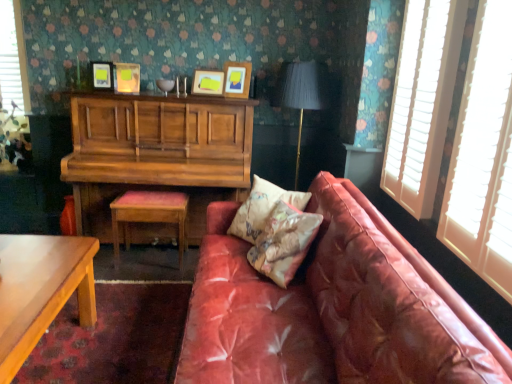
Question: Does matte black lampshade at center lie behind matte wooden picture frame at upper center, placed as the 2th picture frame when sorted from right to left?

Choices:
 (A) yes
 (B) no

Answer: (B)

Question: Is matte black lampshade at center to the right of matte wooden picture frame at upper center, marked as the 3th picture frame in a left-to-right arrangement, from the viewer's perspective?

Choices:
 (A) no
 (B) yes

Answer: (B)

Question: Does matte black lampshade at center lie in front of matte wooden picture frame at upper center, marked as the 3th picture frame in a left-to-right arrangement?

Choices:
 (A) no
 (B) yes

Answer: (B)

Question: Considering the relative sizes of matte black lampshade at center and matte wooden picture frame at upper center, marked as the 3th picture frame in a left-to-right arrangement, in the image provided, is matte black lampshade at center wider than matte wooden picture frame at upper center, marked as the 3th picture frame in a left-to-right arrangement,?

Choices:
 (A) no
 (B) yes

Answer: (B)

Question: Is there a large distance between matte black lampshade at center and matte wooden picture frame at upper center, placed as the 2th picture frame when sorted from right to left?

Choices:
 (A) yes
 (B) no

Answer: (B)

Question: Considering the positions of point (422, 148) and point (119, 64), is point (422, 148) closer or farther from the camera than point (119, 64)?

Choices:
 (A) closer
 (B) farther

Answer: (A)

Question: In terms of width, does white wooden blinds at right look wider or thinner when compared to matte yellow picture frame at upper center, the 2th picture frame viewed from the left?

Choices:
 (A) wide
 (B) thin

Answer: (B)

Question: In the image, is white wooden blinds at right positioned in front of or behind matte yellow picture frame at upper center, the 3th picture frame from the right?

Choices:
 (A) front
 (B) behind

Answer: (A)

Question: From the image's perspective, is white wooden blinds at right located above or below matte yellow picture frame at upper center, the 3th picture frame from the right?

Choices:
 (A) below
 (B) above

Answer: (A)

Question: Does point (108, 61) appear closer or farther from the camera than point (262, 241)?

Choices:
 (A) closer
 (B) farther

Answer: (B)

Question: Considering the positions of matte yellow picture frame at upper center, the first picture frame from the left, and floral fabric pillow at center, which is the 2th pillow in back-to-front order, in the image, is matte yellow picture frame at upper center, the first picture frame from the left, wider or thinner than floral fabric pillow at center, which is the 2th pillow in back-to-front order,?

Choices:
 (A) wide
 (B) thin

Answer: (B)

Question: From a real-world perspective, is matte yellow picture frame at upper center, positioned as the 4th picture frame in right-to-left order, above or below floral fabric pillow at center, positioned as the first pillow in front-to-back order?

Choices:
 (A) above
 (B) below

Answer: (A)

Question: Is matte yellow picture frame at upper center, the first picture frame from the left, to the left or to the right of floral fabric pillow at center, which is the 2th pillow in back-to-front order, in the image?

Choices:
 (A) right
 (B) left

Answer: (B)

Question: Looking at their shapes, would you say matte wooden picture frame at upper center, placed as the 2th picture frame when sorted from right to left, is wider or thinner than matte black lampshade at center?

Choices:
 (A) thin
 (B) wide

Answer: (A)

Question: Is matte wooden picture frame at upper center, marked as the 3th picture frame in a left-to-right arrangement, bigger or smaller than matte black lampshade at center?

Choices:
 (A) big
 (B) small

Answer: (B)